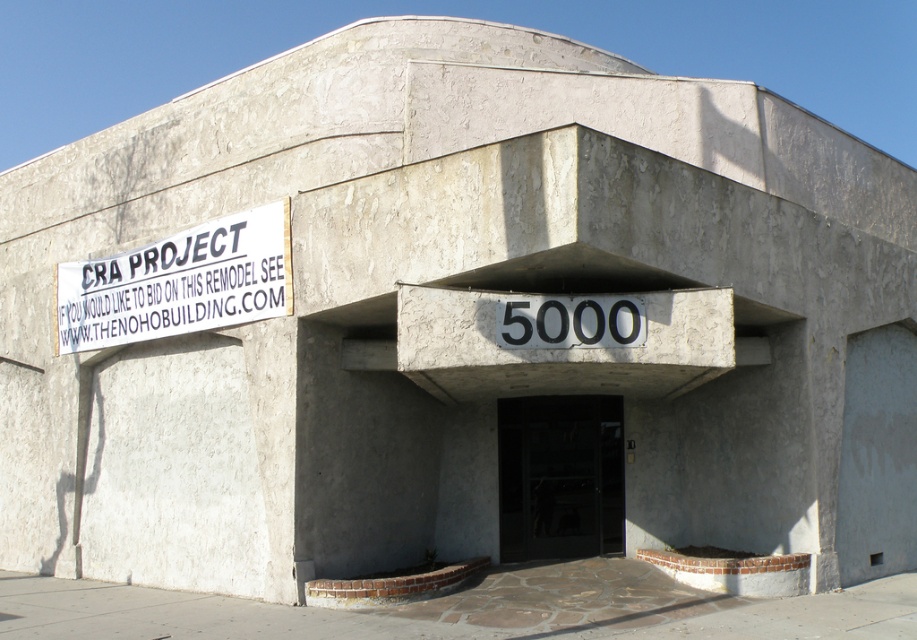
Question: Which object is the farthest from the black glass door at center?

Choices:
 (A) white paper sign at upper left
 (B) gray concrete at lower center

Answer: (A)

Question: Considering the real-world distances, which object is farthest from the black glass door at center?

Choices:
 (A) white paper sign at upper left
 (B) gray concrete at lower center

Answer: (A)

Question: Which object is positioned closest to the black glass door at center?

Choices:
 (A) gray concrete at lower center
 (B) white paper sign at upper left

Answer: (A)

Question: Does white paper sign at upper left appear over black glass door at center?

Choices:
 (A) no
 (B) yes

Answer: (B)

Question: In this image, where is gray concrete at lower center located relative to white paper sign at upper left?

Choices:
 (A) above
 (B) below

Answer: (B)

Question: Does gray concrete at lower center have a greater width compared to black glass door at center?

Choices:
 (A) no
 (B) yes

Answer: (B)